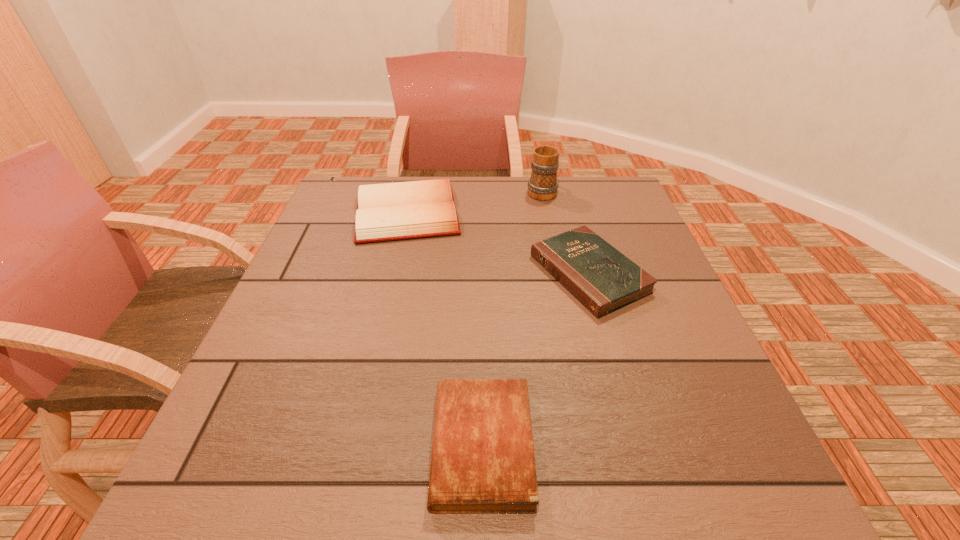
You are a GUI agent. You are given a task and a screenshot of the screen. Output one action in this format:
    pyautogui.click(x=<x>, y=<y>)
    Task: Click on the empty space that is in between the rightmost Bible and the nearest object
    
    Given the screenshot: What is the action you would take?
    pyautogui.click(x=536, y=360)

The height and width of the screenshot is (540, 960). I want to click on empty space between the mug and the nearest Bible, so click(512, 318).

Image resolution: width=960 pixels, height=540 pixels. I want to click on vacant area between the mug and the nearest object, so click(512, 318).

Locate an element on the screen. free area in between the nearest object and the tallest object is located at coordinates (512, 318).

What are the coordinates of `object that can be found as the closest to the nearest object` in the screenshot? It's located at (601, 278).

You are a GUI agent. You are given a task and a screenshot of the screen. Output one action in this format:
    pyautogui.click(x=<x>, y=<y>)
    Task: Click on the object that stands as the third closest to the tallest object
    The image size is (960, 540).
    Given the screenshot: What is the action you would take?
    pyautogui.click(x=482, y=462)

In order to click on Bible identified as the closest to the rightmost Bible in this screenshot , I will do pos(404,210).

This screenshot has width=960, height=540. What are the coordinates of `Bible that is the closest to the nearest object` in the screenshot? It's located at (601, 278).